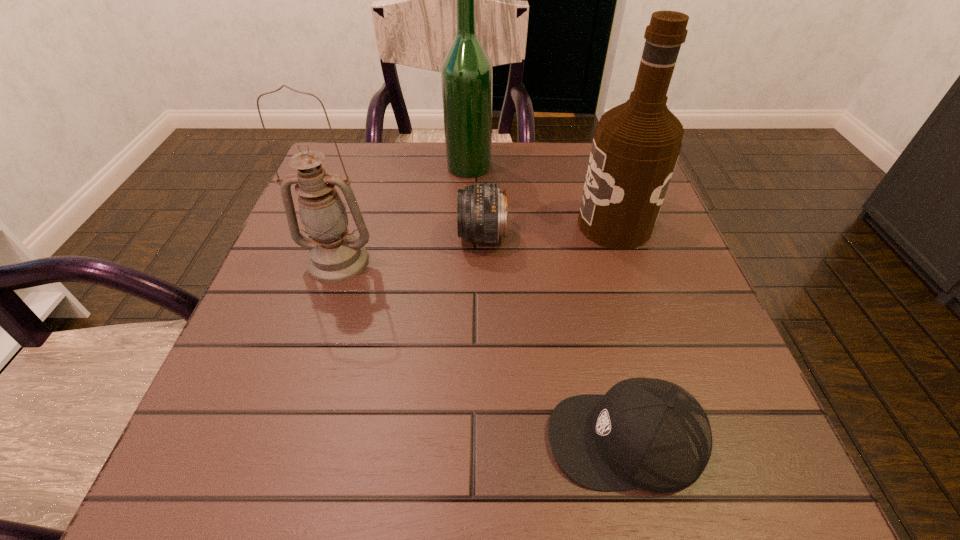
Image resolution: width=960 pixels, height=540 pixels. In order to click on the left alcohol in this screenshot , I will do `click(467, 74)`.

I want to click on the farther alcohol, so click(x=467, y=74).

Where is `the nearer alcohol`? Image resolution: width=960 pixels, height=540 pixels. the nearer alcohol is located at coordinates (635, 148).

At what (x,y) coordinates should I click in order to perform the action: click on the leftmost object. Please return your answer as a coordinate pair (x, y). The height and width of the screenshot is (540, 960). Looking at the image, I should click on (335, 255).

Where is `the third shortest object`? the third shortest object is located at coordinates (335, 255).

Image resolution: width=960 pixels, height=540 pixels. In order to click on the fourth tallest object in this screenshot , I will do `click(482, 215)`.

At what (x,y) coordinates should I click in order to perform the action: click on cap. Please return your answer as a coordinate pair (x, y). This screenshot has height=540, width=960. Looking at the image, I should click on (646, 433).

Locate an element on the screen. the nearest object is located at coordinates (646, 433).

Image resolution: width=960 pixels, height=540 pixels. I want to click on free spot located 0.190m on the left of the farther alcohol, so click(372, 166).

Identify the location of vacant space located on the label of the nearer alcohol. This screenshot has width=960, height=540. click(444, 225).